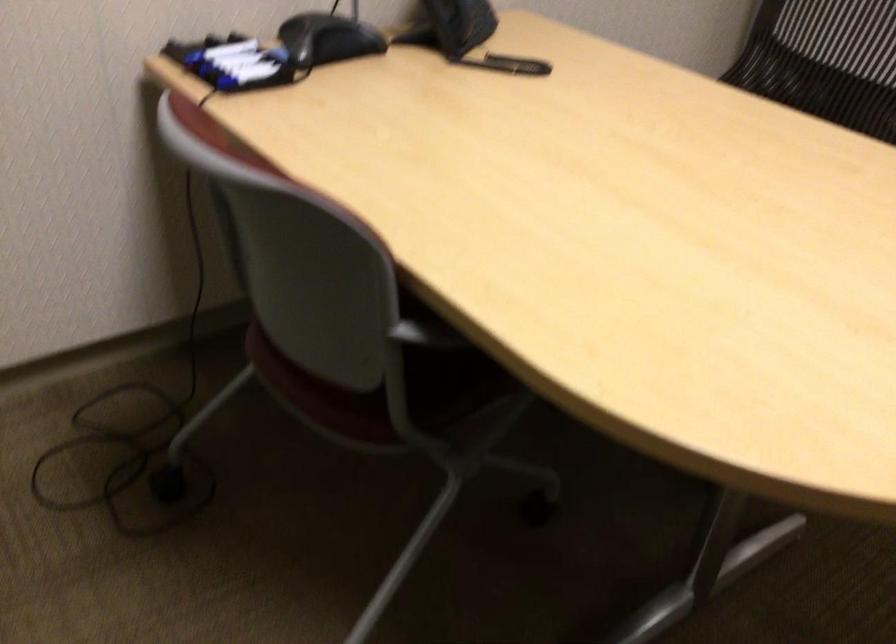
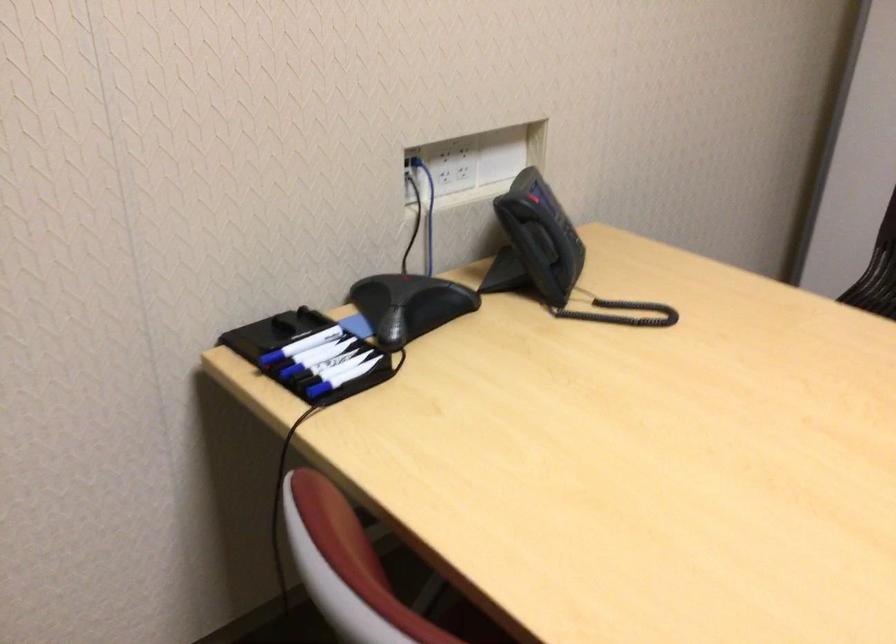
In the second image, find the point that corresponds to point 230,84 in the first image.

(320, 393)